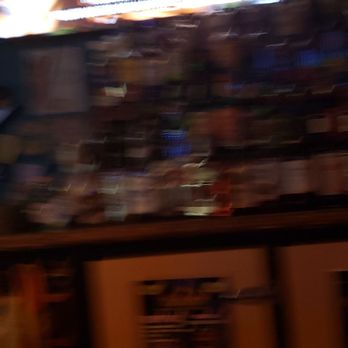
At what (x,y) coordinates should I click in order to perform the action: click on books. Please return your answer as a coordinate pair (x, y). This screenshot has height=348, width=348. Looking at the image, I should click on (64, 311), (32, 310).